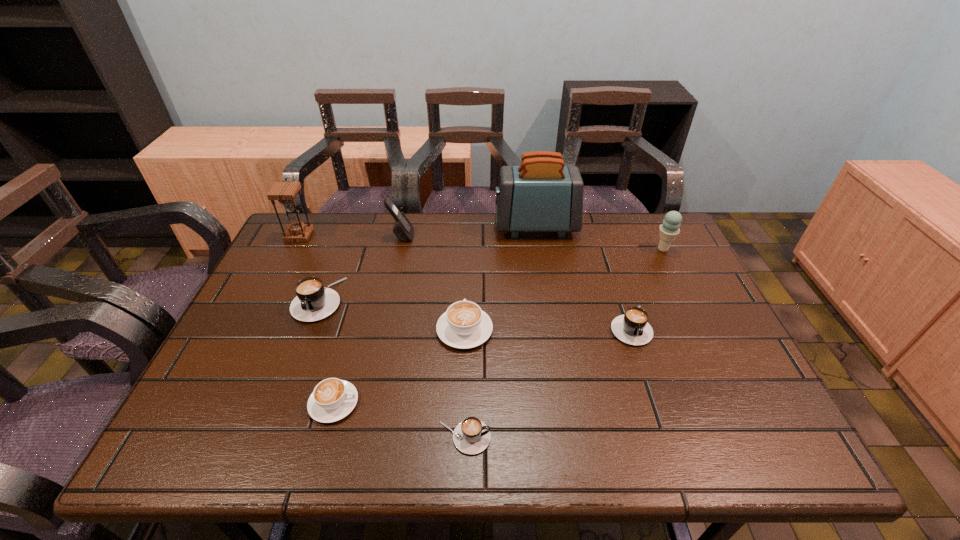
The height and width of the screenshot is (540, 960). In the image, there is a desktop. In order to click on vacant space at the near edge in this screenshot , I will do point(667,454).

At what (x,y) coordinates should I click in order to perform the action: click on free space at the left edge of the desktop. Please return your answer as a coordinate pair (x, y). Looking at the image, I should click on (296, 281).

In the image, there is a desktop. Where is `vacant space at the right edge`? The height and width of the screenshot is (540, 960). vacant space at the right edge is located at coordinates (746, 397).

Find the location of a particular element. This screenshot has height=540, width=960. vacant space at the far left corner is located at coordinates (326, 244).

In the image, there is a desktop. Where is `vacant space at the far right corner`? This screenshot has height=540, width=960. vacant space at the far right corner is located at coordinates (634, 246).

Image resolution: width=960 pixels, height=540 pixels. Identify the location of vacant point located between the toaster and the bigger white cappuccino. (500, 278).

The width and height of the screenshot is (960, 540). Identify the location of free space that is in between the smaller white cappuccino and the nearest black cappuccino. (399, 420).

Identify the location of unoccupied area between the smaller white cappuccino and the nearest black cappuccino. (399, 420).

Where is `unoccupied position between the biggest black cappuccino and the hourglass`? unoccupied position between the biggest black cappuccino and the hourglass is located at coordinates (308, 267).

Where is `vacant space that is in between the leftmost black cappuccino and the cellular telephone`? This screenshot has width=960, height=540. vacant space that is in between the leftmost black cappuccino and the cellular telephone is located at coordinates (360, 268).